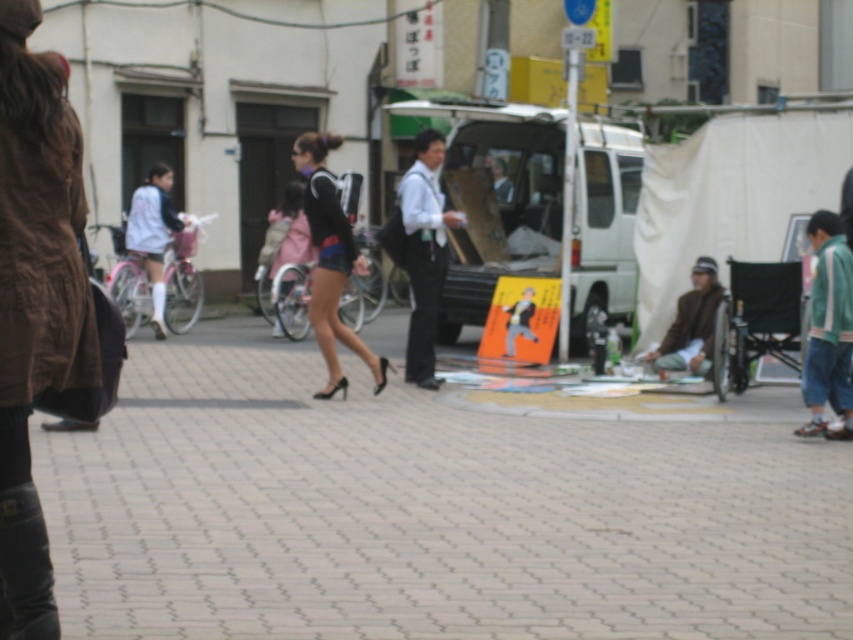
Question: Which point is farther to the camera?

Choices:
 (A) (337, 330)
 (B) (486, 184)

Answer: (B)

Question: Which object is the farthest from the black leather boot at lower left?

Choices:
 (A) white matte van at center
 (B) paved stone sidewalk at center
 (C) matte black shorts at center

Answer: (A)

Question: Does paved stone sidewalk at center come in front of black leather boot at lower left?

Choices:
 (A) no
 (B) yes

Answer: (A)

Question: Is paved stone sidewalk at center wider than matte black shorts at center?

Choices:
 (A) yes
 (B) no

Answer: (A)

Question: Among these objects, which one is nearest to the camera?

Choices:
 (A) paved stone sidewalk at center
 (B) white matte van at center

Answer: (A)

Question: Is brown leather jacket at upper left positioned behind matte black shorts at center?

Choices:
 (A) no
 (B) yes

Answer: (A)